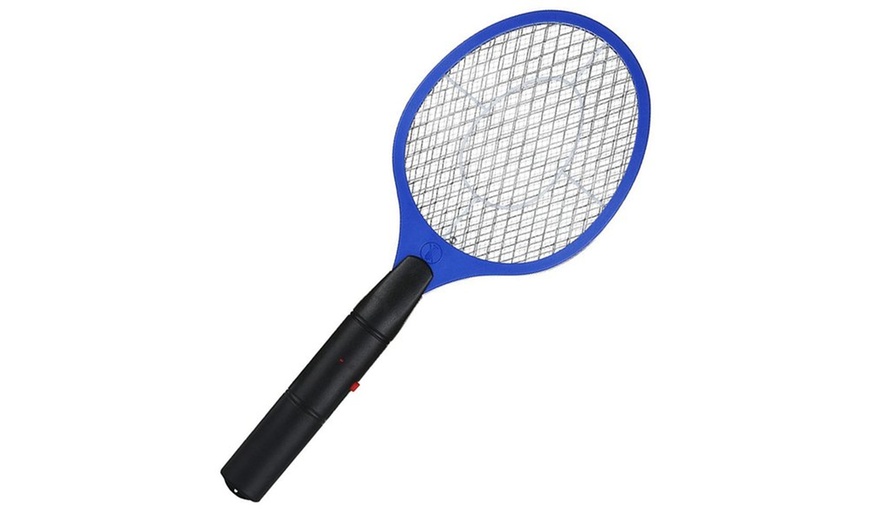
Locate an element on the screen. The width and height of the screenshot is (870, 524). red  switch is located at coordinates (351, 386).